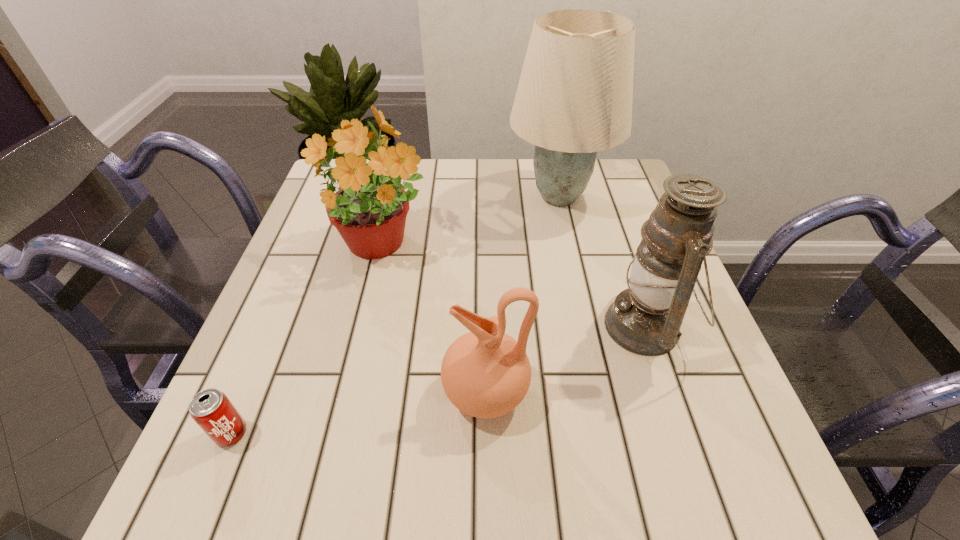
Find the location of a particular element. lampshade is located at coordinates (574, 98).

Where is `oil lamp`? oil lamp is located at coordinates (645, 319).

Where is `flowerpot`? This screenshot has height=540, width=960. flowerpot is located at coordinates (369, 210).

Locate an element on the screen. pottery is located at coordinates (485, 373).

This screenshot has width=960, height=540. In order to click on the shortest object in this screenshot , I will do `click(211, 409)`.

You are a GUI agent. You are given a task and a screenshot of the screen. Output one action in this format:
    pyautogui.click(x=<x>, y=<y>)
    Task: Click on the leftmost object
    The height and width of the screenshot is (540, 960).
    Given the screenshot: What is the action you would take?
    pyautogui.click(x=211, y=409)

Find the location of a particular element. Image resolution: width=960 pixels, height=540 pixels. vacant region located on the left of the lampshade is located at coordinates coord(408,197).

Find the location of a particular element. This screenshot has width=960, height=540. vacant space positioned on the left of the oil lamp is located at coordinates (482, 326).

Image resolution: width=960 pixels, height=540 pixels. Find the location of `free space located on the right of the flowerpot`. free space located on the right of the flowerpot is located at coordinates (578, 247).

Identify the location of free space located 0.140m on the spout of the pottery. (362, 393).